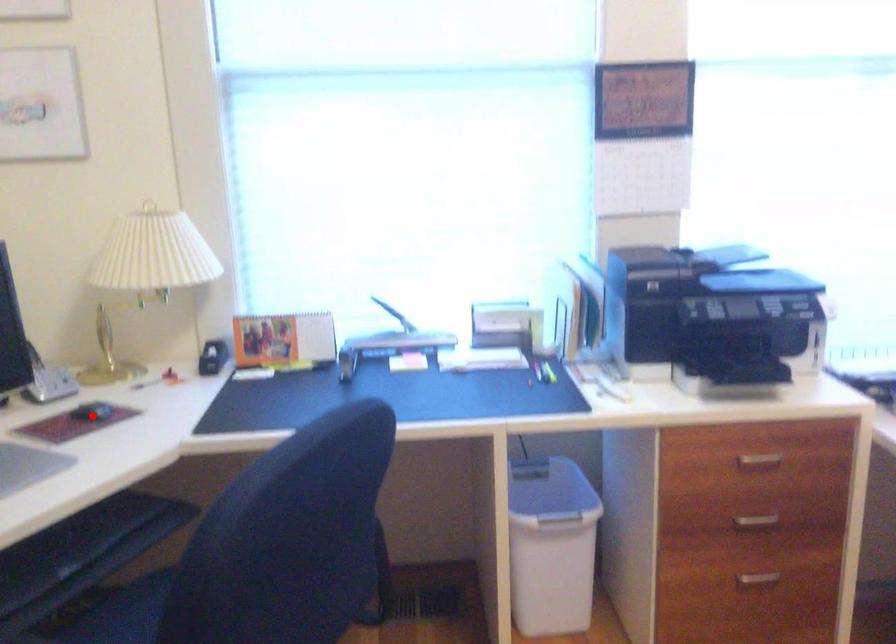
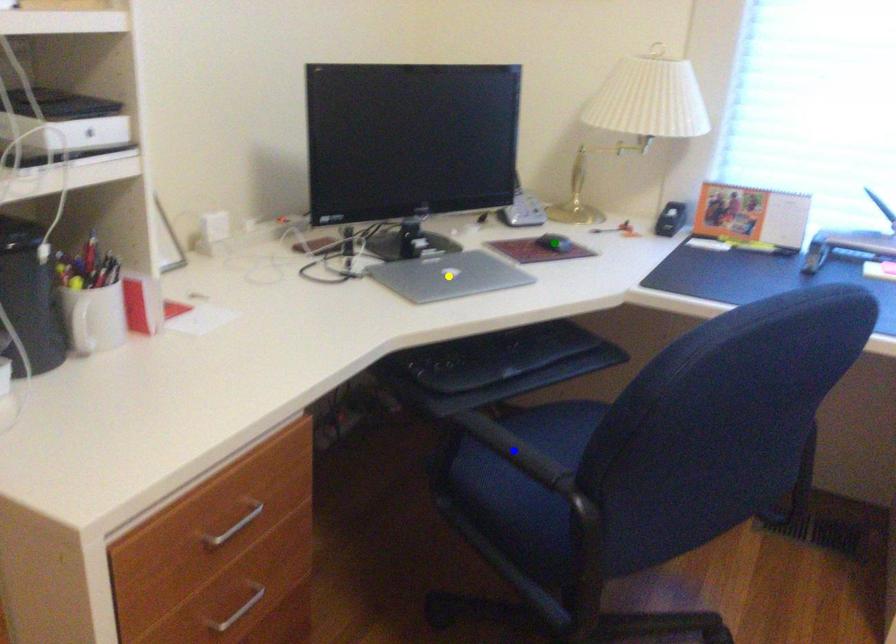
Question: I am providing you with two images of the same scene from different viewpoints. A red point is marked on the first image. You are given multiple points on the second image. Which point in image 2 represents the same 3d spot as the red point in image 1?

Choices:
 (A) green point
 (B) blue point
 (C) yellow point

Answer: (A)